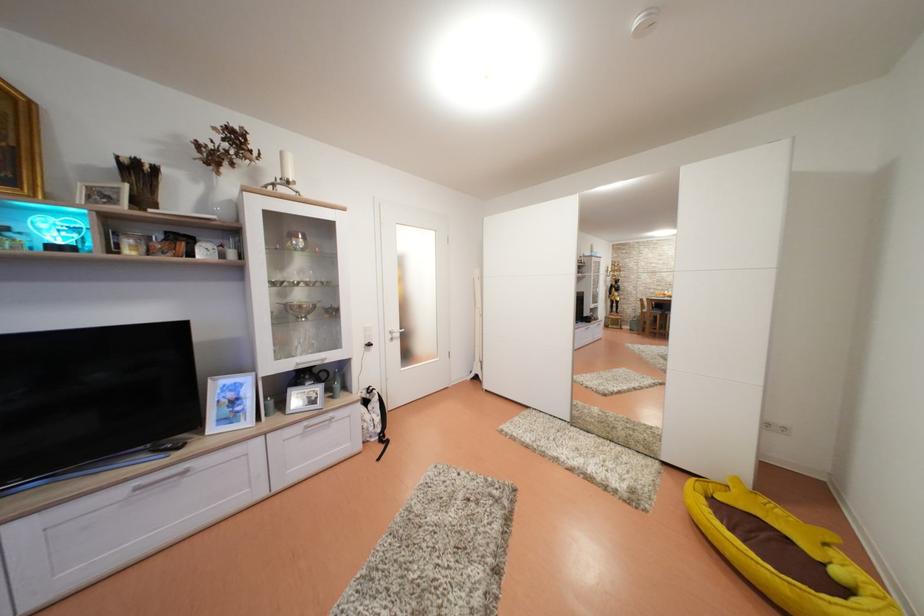
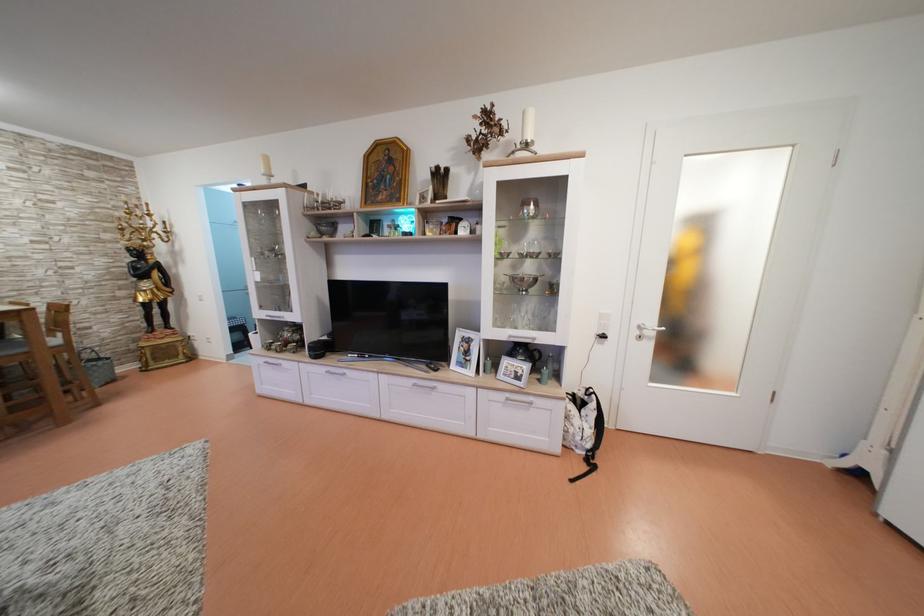
Find the pixel in the second image that matches pixel 377 395 in the first image.

(596, 398)